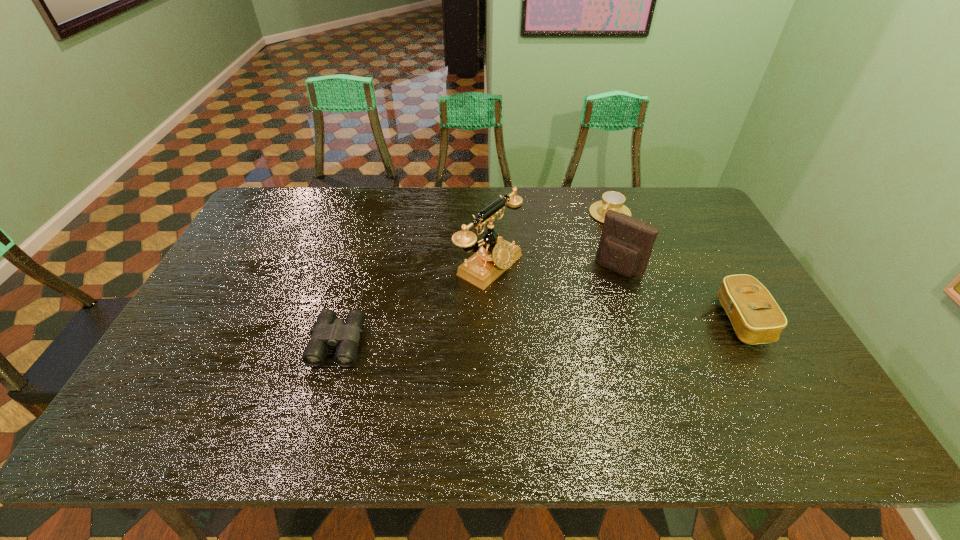
The width and height of the screenshot is (960, 540). In order to click on vacant area situated with an open flap on the pouch in this screenshot , I will do `click(547, 358)`.

At what (x,y) coordinates should I click in order to perform the action: click on vacant area situated 0.310m on the dial of the tallest object. Please return your answer as a coordinate pair (x, y). The width and height of the screenshot is (960, 540). Looking at the image, I should click on (613, 335).

Locate an element on the screen. free space located on the dial of the tallest object is located at coordinates (600, 327).

You are a GUI agent. You are given a task and a screenshot of the screen. Output one action in this format:
    pyautogui.click(x=<x>, y=<y>)
    Task: Click on the blank space located 0.390m on the dial of the tallest object
    
    Given the screenshot: What is the action you would take?
    pyautogui.click(x=642, y=350)

At what (x,y) coordinates should I click in order to perform the action: click on vacant area situated 0.200m with the handle on the side of the farthest object. Please return your answer as a coordinate pair (x, y). The image size is (960, 540). Looking at the image, I should click on (567, 251).

Locate an element on the screen. free space located 0.200m with the handle on the side of the farthest object is located at coordinates (567, 251).

Find the location of `vacant region located 0.100m with the handle on the side of the farthest object`. vacant region located 0.100m with the handle on the side of the farthest object is located at coordinates (584, 236).

This screenshot has width=960, height=540. Identify the location of object that is at the far edge. (611, 200).

The width and height of the screenshot is (960, 540). I want to click on object at the near edge, so click(328, 331).

Identify the location of object that is at the right edge. The height and width of the screenshot is (540, 960). (756, 317).